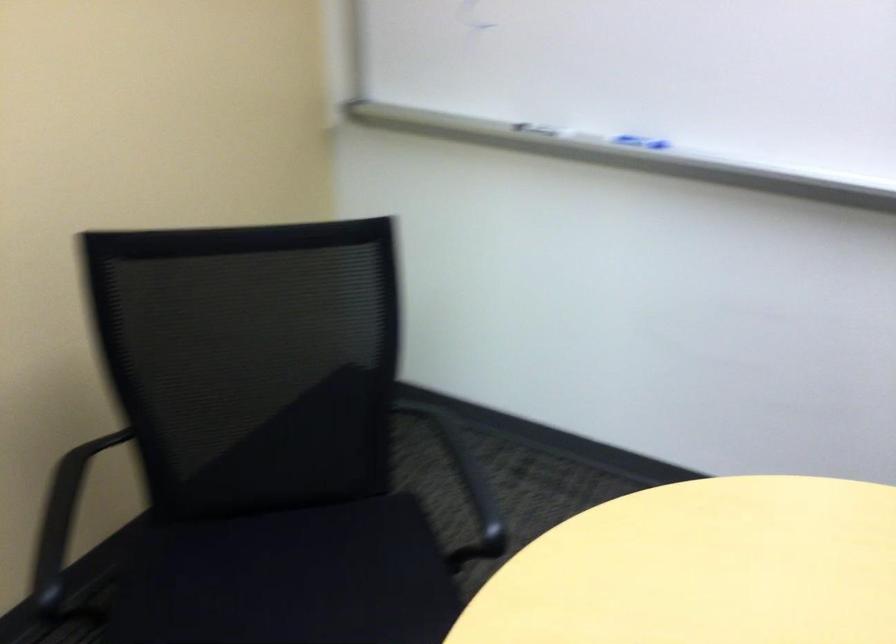
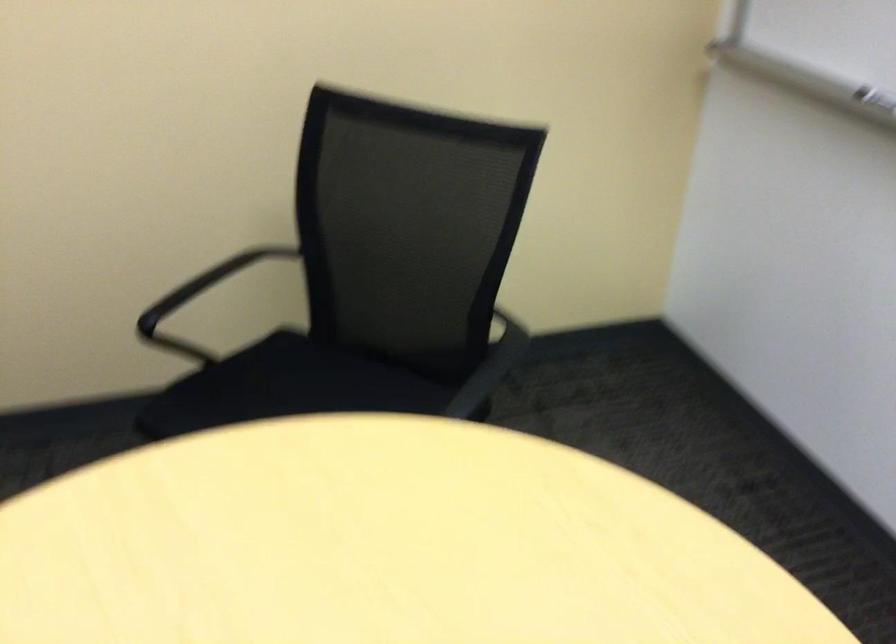
Question: The camera is either moving clockwise (left) or counter-clockwise (right) around the object. The first image is from the beginning of the video and the second image is from the end. Is the camera moving left or right when shooting the video?

Choices:
 (A) Left
 (B) Right

Answer: (B)